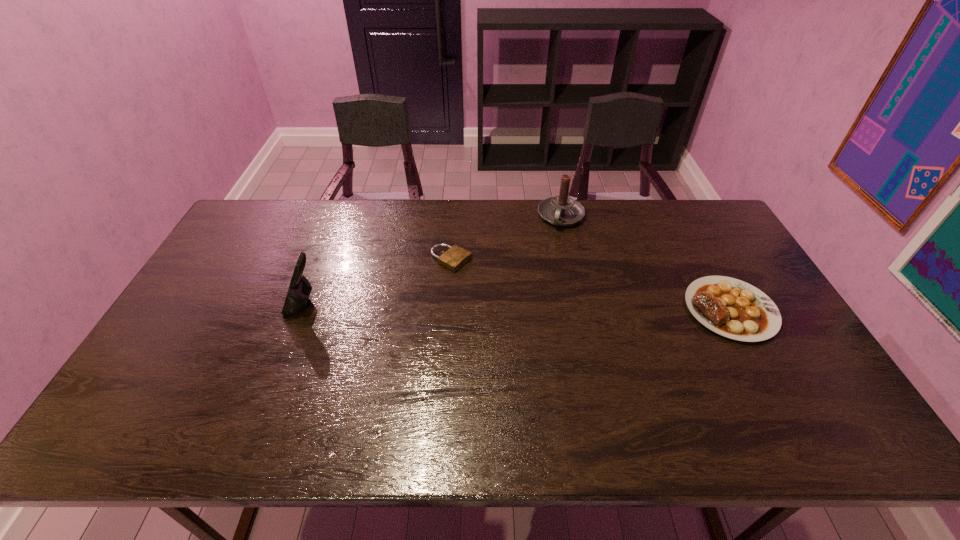
The width and height of the screenshot is (960, 540). I want to click on free space on the desktop that is between the leftmost object and the steak and is positioned on the side of the farthest object with the handle loop, so click(527, 307).

Where is `free space on the desktop that is between the leftmost object and the rightmost object and is positioned on the keyhole side of the third nearest object`? free space on the desktop that is between the leftmost object and the rightmost object and is positioned on the keyhole side of the third nearest object is located at coordinates (541, 307).